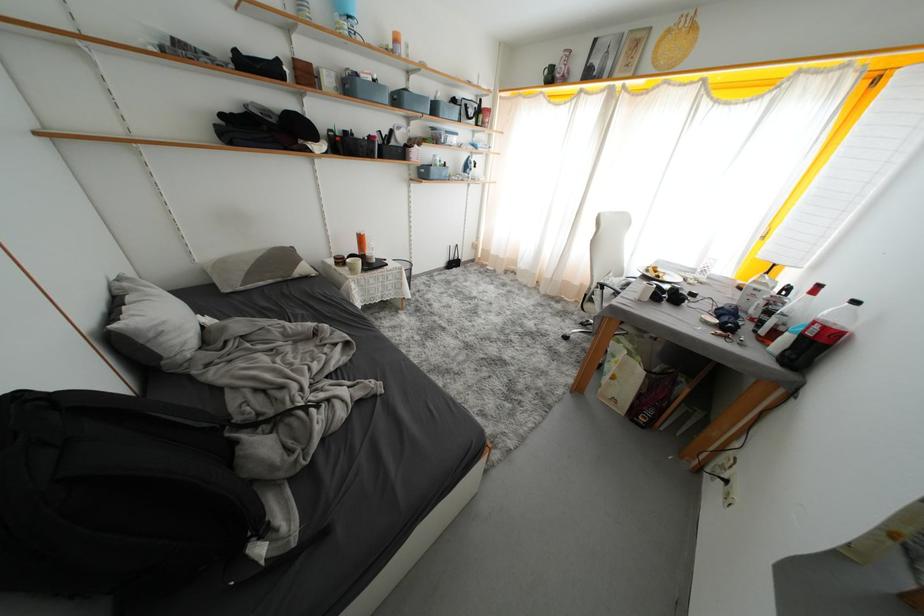
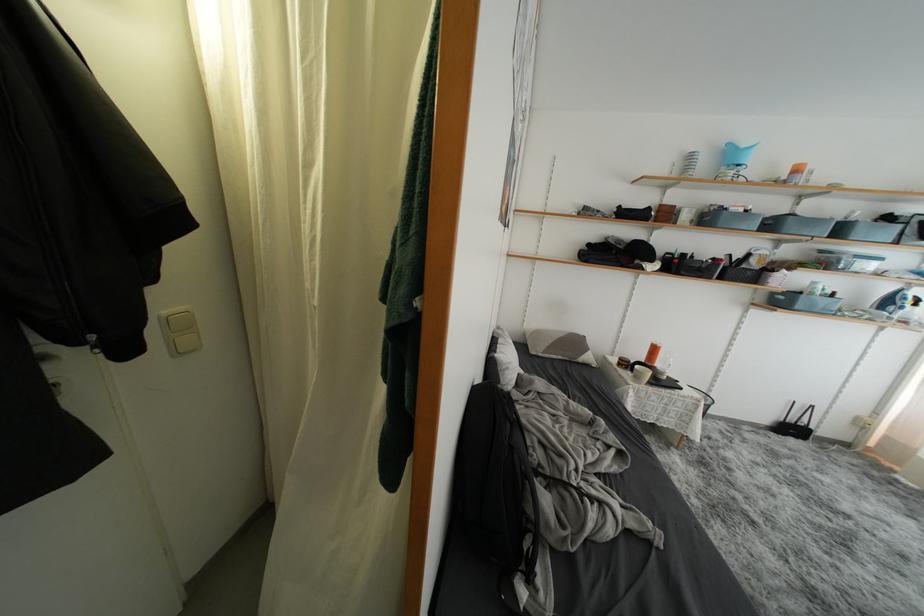
Where in the second image is the point corresponding to point (441, 113) from the first image?

(847, 235)